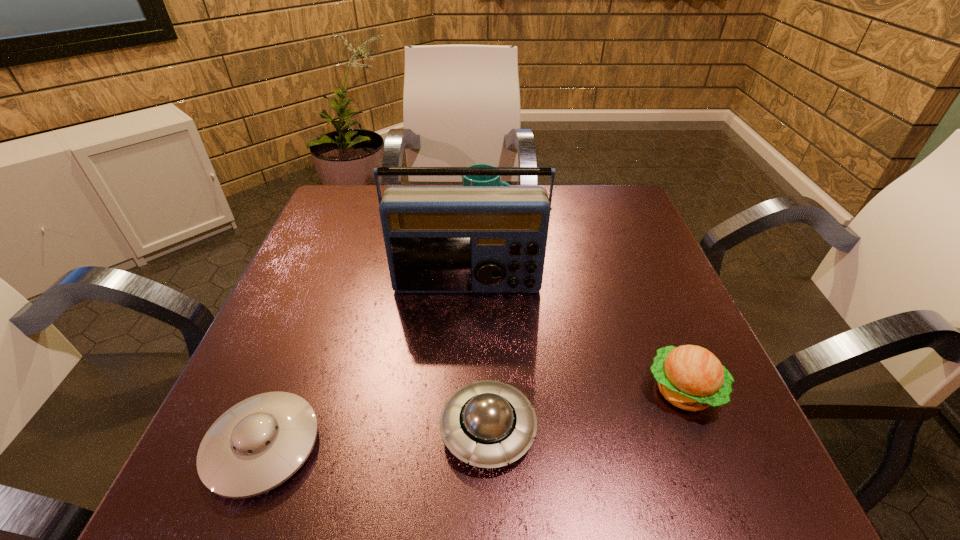
The width and height of the screenshot is (960, 540). I want to click on vacant area at the near edge of the desktop, so click(363, 450).

The width and height of the screenshot is (960, 540). In the image, there is a desktop. Find the location of `free space at the left edge`. free space at the left edge is located at coordinates (293, 332).

This screenshot has height=540, width=960. Identify the location of vacant region at the right edge of the desktop. (653, 296).

You are a GUI agent. You are given a task and a screenshot of the screen. Output one action in this format:
    pyautogui.click(x=<x>, y=<y>)
    Task: Click on the free space at the far right corner of the desktop
    
    Given the screenshot: What is the action you would take?
    pyautogui.click(x=584, y=207)

Where is `free region at the near right corner of the desktop`? Image resolution: width=960 pixels, height=540 pixels. free region at the near right corner of the desktop is located at coordinates (756, 485).

The height and width of the screenshot is (540, 960). In order to click on free point between the tallest object and the second shortest object in this screenshot , I will do `click(477, 357)`.

You are a GUI agent. You are given a task and a screenshot of the screen. Output one action in this format:
    pyautogui.click(x=<x>, y=<y>)
    Task: Click on the free spot between the second shortest object and the leftmost object
    The image size is (960, 540).
    Given the screenshot: What is the action you would take?
    pyautogui.click(x=375, y=438)

This screenshot has height=540, width=960. What are the coordinates of `empty space that is in between the cup and the taller saucer` in the screenshot? It's located at (488, 321).

The width and height of the screenshot is (960, 540). Find the location of `free space between the taller saucer and the third tallest object`. free space between the taller saucer and the third tallest object is located at coordinates (586, 410).

You are a GUI agent. You are given a task and a screenshot of the screen. Output one action in this format:
    pyautogui.click(x=<x>, y=<y>)
    Task: Click on the empty location between the left saucer and the fourth nearest object
    The width and height of the screenshot is (960, 540).
    Given the screenshot: What is the action you would take?
    pyautogui.click(x=365, y=366)